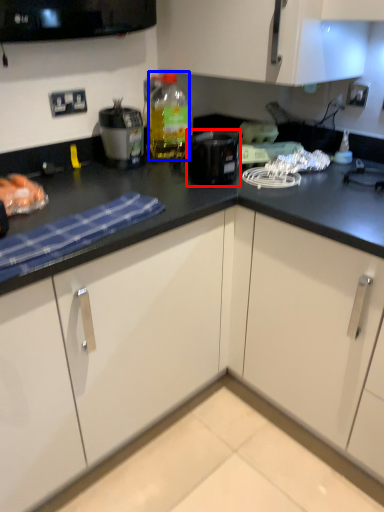
Question: Which point is further to the camera, kitchen appliance (highlighted by a red box) or bottle (highlighted by a blue box)?

Choices:
 (A) kitchen appliance
 (B) bottle

Answer: (B)